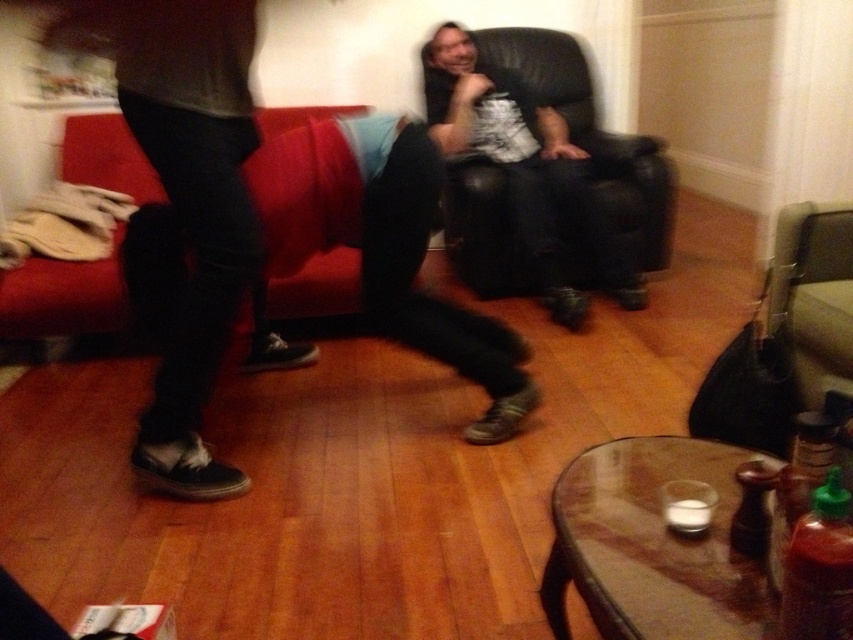
You are planning to place a new coffee table between the matte black leather chair at center and the red fabric couch at left. According to the scene, which piece of furniture is positioned behind the other, and how does this affect where you should place the coffee table?

The red fabric couch at left is behind the matte black leather chair at center. This means the coffee table should be placed in front of the matte black leather chair at center to ensure it is accessible from both the chair and the couch.

You are standing at the origin of the coordinate system in the living room. There is a point marked at coordinate (x=524, y=168). What object is located at that point?

The point at coordinate (x=524, y=168) marks the location of the matte black leather chair at center.

In the scene shown: You are planning to host a small gathering and need to seat 4 guests comfortably. The living room has a matte black leather chair at center and a red fabric couch at left. Considering their sizes, which furniture piece can accommodate more people?

The matte black leather chair at center is larger in size than the red fabric couch at left, so it can accommodate more people.